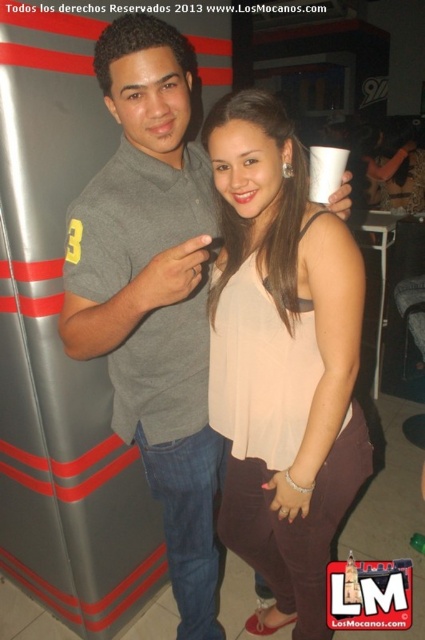
Which is below, gray cotton polo shirt at center or white paper cup at center?

gray cotton polo shirt at center

How distant is gray cotton polo shirt at center from white paper cup at center?

A distance of 23.99 inches exists between gray cotton polo shirt at center and white paper cup at center.

Is point (102, 259) farther from viewer compared to point (331, 170)?

No, it is not.

Locate an element on the screen. gray cotton polo shirt at center is located at coordinates (x=153, y=296).

Does matte beige blouse at center appear over gray cotton polo shirt at center?

Incorrect, matte beige blouse at center is not positioned above gray cotton polo shirt at center.

Is matte beige blouse at center taller than gray cotton polo shirt at center?

Incorrect, matte beige blouse at center's height is not larger of gray cotton polo shirt at center's.

At what (x,y) coordinates should I click in order to perform the action: click on matte beige blouse at center. Please return your answer as a coordinate pair (x, y). The width and height of the screenshot is (425, 640). Looking at the image, I should click on (285, 360).

Find the location of a particular element. The image size is (425, 640). matte beige blouse at center is located at coordinates tap(285, 360).

Who is shorter, matte beige blouse at center or white paper cup at center?

With less height is white paper cup at center.

Is point (232, 492) positioned behind point (320, 156)?

Yes, it is.

Identify the location of matte beige blouse at center. This screenshot has height=640, width=425. point(285,360).